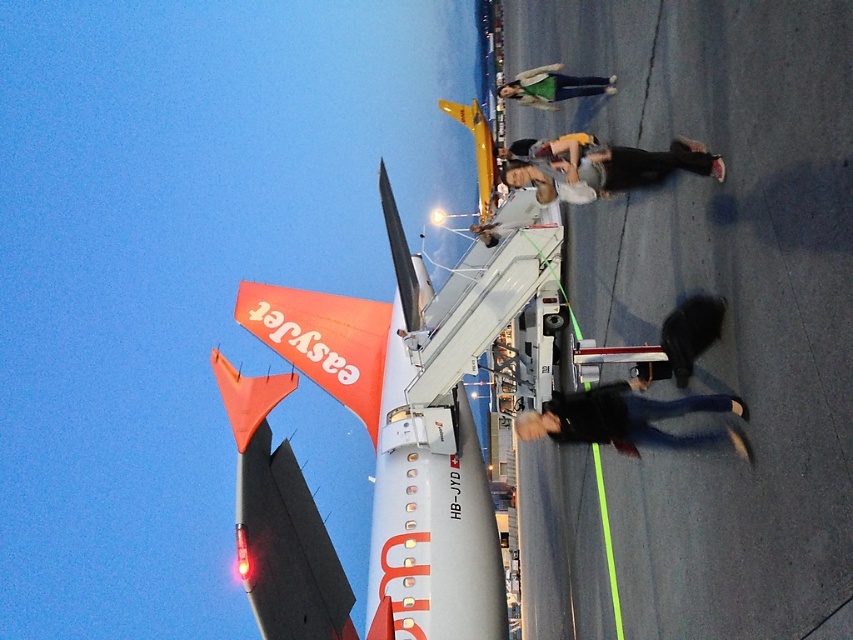
You are an airport staff member observing the scene. You notice two passengers wearing jackets. One is wearing a black matte jacket at lower right and the other a matte gray jacket at center. Which passenger is shorter in height?

The black matte jacket at lower right is not as tall as the matte gray jacket at center, so the passenger wearing the black matte jacket at lower right is shorter in height.